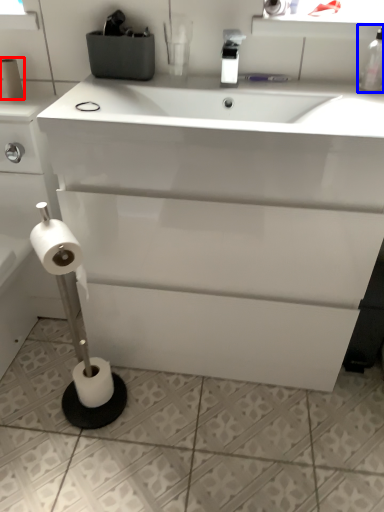
Question: Which object is further to the camera taking this photo, toilet paper (highlighted by a red box) or bottle (highlighted by a blue box)?

Choices:
 (A) toilet paper
 (B) bottle

Answer: (A)